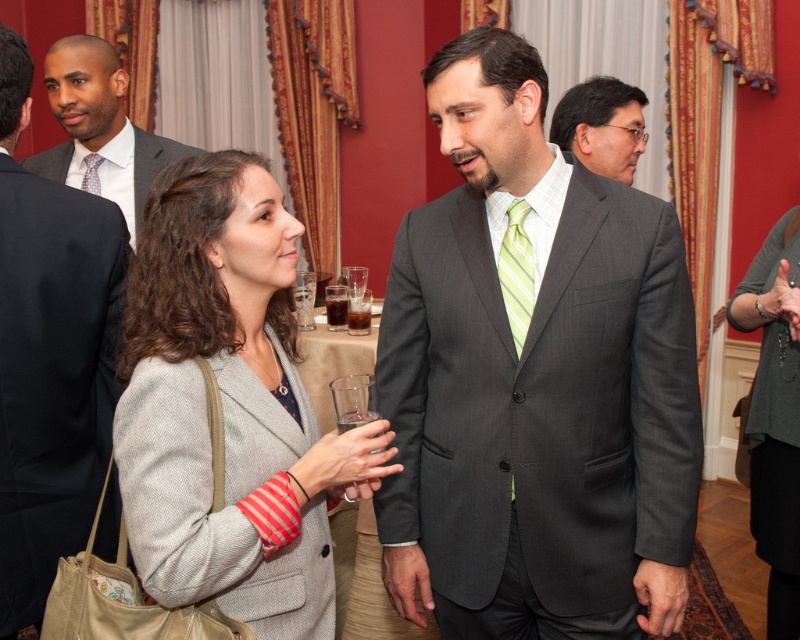
Looking at this image, you are a photographer standing in the room and want to take a closeup photo of the gray suit at center. The camera you are using has a minimum focusing distance of 1.2 meters. Can you take the photo without moving closer?

The gray suit at center is 1.31 meters away from the viewer. Since the camera can focus as close as 1.2 meters, you can take the closeup photo without moving closer because the distance is within the camera

You are a photographer at this event and need to capture a closeup of the green striped tie at center without moving the subject. Can you achieve this with a standard camera lens that has a maximum focal length of 200mm? Explain your reasoning.

The green striped tie at center is 1.36 meters from the camera. With a standard camera lens of 200mm focal length, you can achieve a closeup shot because the distance is within a manageable range for such lenses without requiring extreme magnification.

You are a photographer at this event and want to capture a photo of the matte black suit at left and the clear glass at center. Since you need to ensure both objects are in focus, which object should you prioritize focusing on first based on their sizes?

The matte black suit at left is larger in width than the clear glass at center, so you should prioritize focusing on the matte black suit at left first as it occupies more space in the frame.